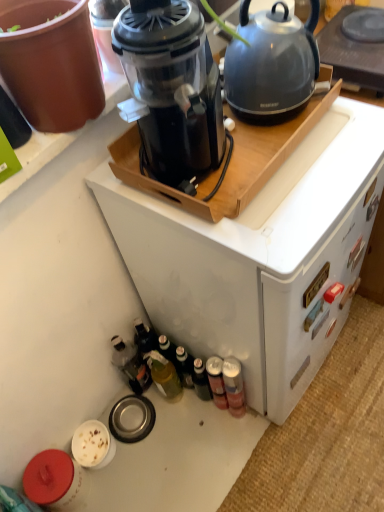
I want to click on vacant space in front of translucent plastic bottle at lower left, the 4th bottle when ordered from right to left, so click(x=163, y=439).